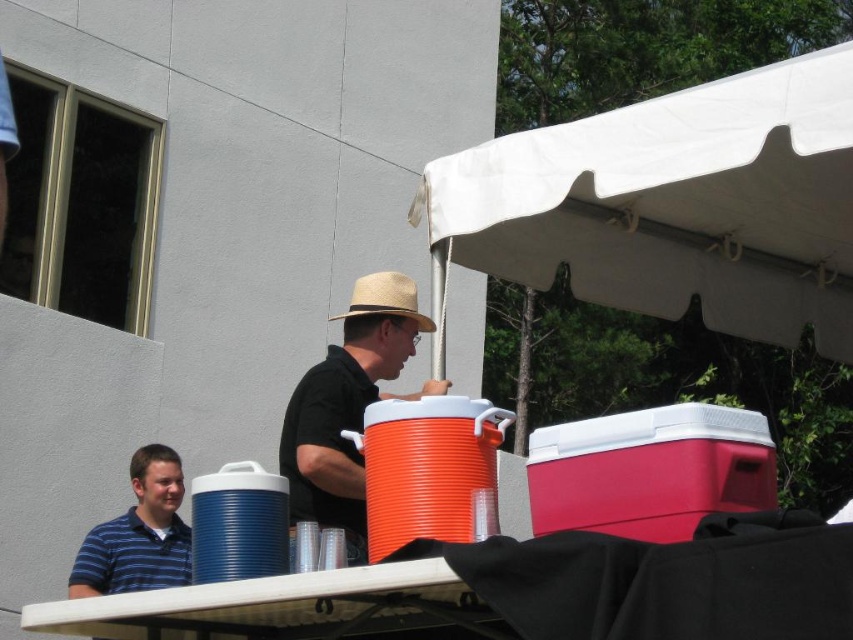
Consider the image. You are at the coordinates given in the objects. What is the object located at point (x=138, y=534)?

The object located at point (x=138, y=534) is the blue striped shirt at lower left.

You are a photographer standing at the edge of the scene. You want to take a photo that includes both the white plastic table at lower center and the matte straw hat at center. Given that your camera has a maximum focus range of 15 feet, will you be able to capture both objects clearly in focus?

The white plastic table at lower center is 18.33 feet away from the matte straw hat at center. Since the maximum focus range of the camera is 15 feet, the distance between them exceeds this limit. Therefore, you cannot capture both objects clearly in focus with the current camera settings.

You are organizing a picnic and need to decide which item to pack first based on size. Which item is smaller between the blue striped shirt at lower left and the strawhat at center?

The blue striped shirt at lower left is smaller compared to the strawhat at center.